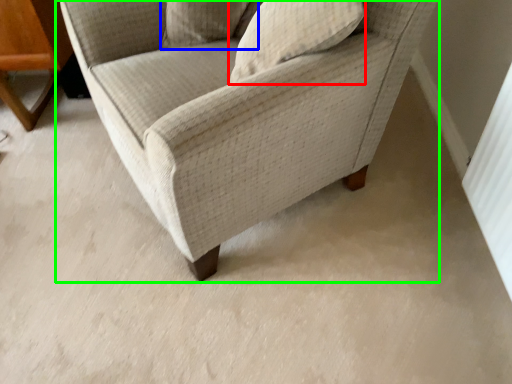
Question: Which object is positioned farthest from pillow (highlighted by a red box)? Select from pillow (highlighted by a blue box) and chair (highlighted by a green box).

Choices:
 (A) pillow
 (B) chair

Answer: (A)